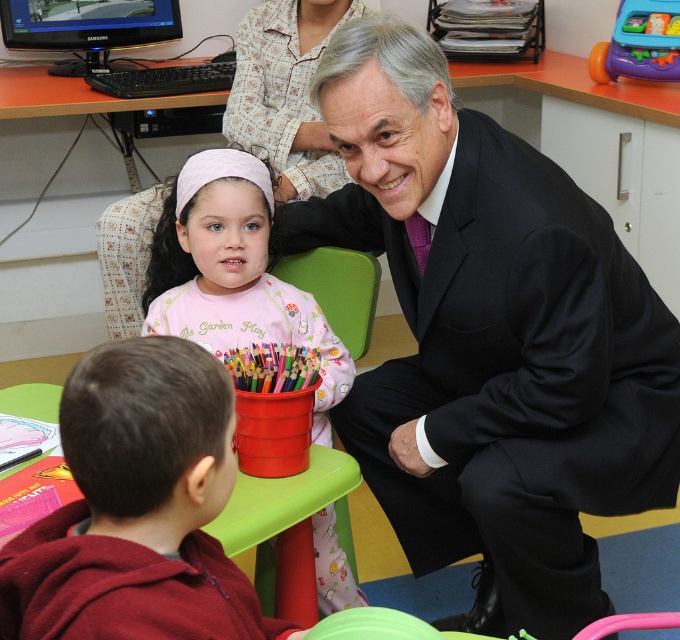
Can you confirm if maroon fleece hoodie at lower left is wider than pink fabric dress at center?

No, maroon fleece hoodie at lower left is not wider than pink fabric dress at center.

This screenshot has height=640, width=680. What do you see at coordinates (137, 508) in the screenshot?
I see `maroon fleece hoodie at lower left` at bounding box center [137, 508].

The width and height of the screenshot is (680, 640). I want to click on maroon fleece hoodie at lower left, so click(137, 508).

Who is higher up, pink fabric dress at center or green plastic chair at center?

Positioned higher is green plastic chair at center.

Is the position of pink fabric dress at center less distant than that of green plastic chair at center?

Yes, pink fabric dress at center is closer to the viewer.

Is point (235, 300) farther from camera compared to point (375, 272)?

No, (235, 300) is in front of (375, 272).

Image resolution: width=680 pixels, height=640 pixels. In order to click on pink fabric dress at center in this screenshot , I will do `click(233, 275)`.

Which is behind, point (420, 566) or point (367, 292)?

Positioned behind is point (420, 566).

Can you confirm if black suit at center is positioned to the left of green plastic chair at center?

In fact, black suit at center is to the right of green plastic chair at center.

Locate an element on the screen. Image resolution: width=680 pixels, height=640 pixels. black suit at center is located at coordinates (490, 339).

The height and width of the screenshot is (640, 680). In order to click on black suit at center in this screenshot , I will do `click(490, 339)`.